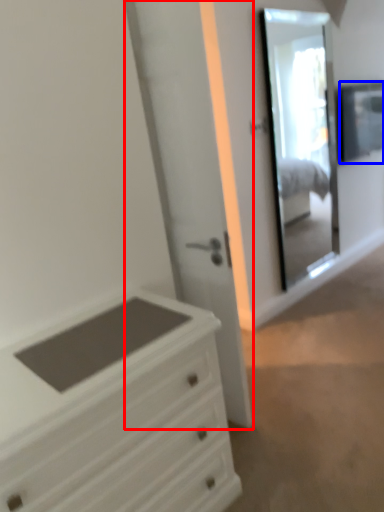
Question: Which object is further to the camera taking this photo, door (highlighted by a red box) or window (highlighted by a blue box)?

Choices:
 (A) door
 (B) window

Answer: (B)